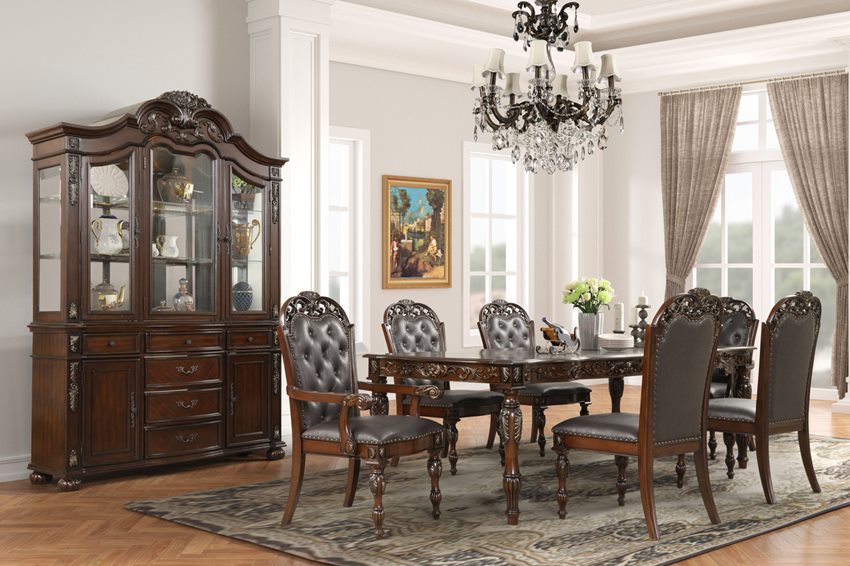
At what (x,y) coordinates should I click in order to perform the action: click on chairs. Please return your answer as a coordinate pair (x, y). Image resolution: width=850 pixels, height=566 pixels. Looking at the image, I should click on (337, 325), (412, 333), (505, 319), (672, 404), (733, 314), (789, 366).